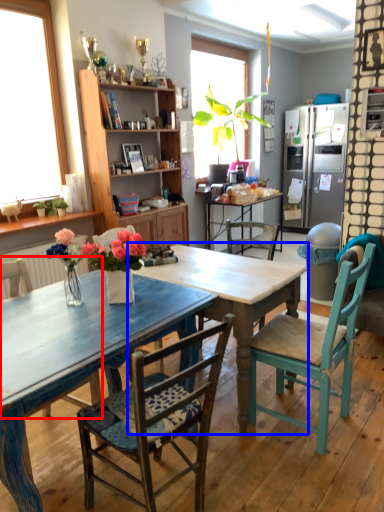
Question: Which of the following is the farthest to the observer, chair (highlighted by a red box) or table (highlighted by a blue box)?

Choices:
 (A) chair
 (B) table

Answer: (B)